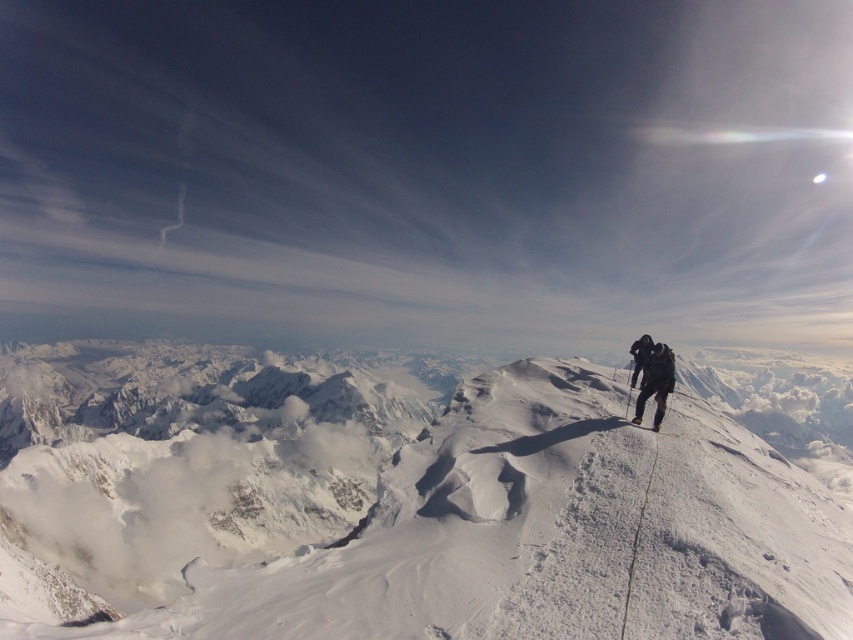
Who is more forward, (635, 499) or (657, 378)?

Point (635, 499) is more forward.

Is white snow-covered mountain at upper center to the left of black fabric pants at center from the viewer's perspective?

In fact, white snow-covered mountain at upper center is to the right of black fabric pants at center.

Is point (152, 548) positioned in front of point (659, 371)?

No, it is behind (659, 371).

In order to click on white snow-covered mountain at upper center in this screenshot , I will do `click(412, 499)`.